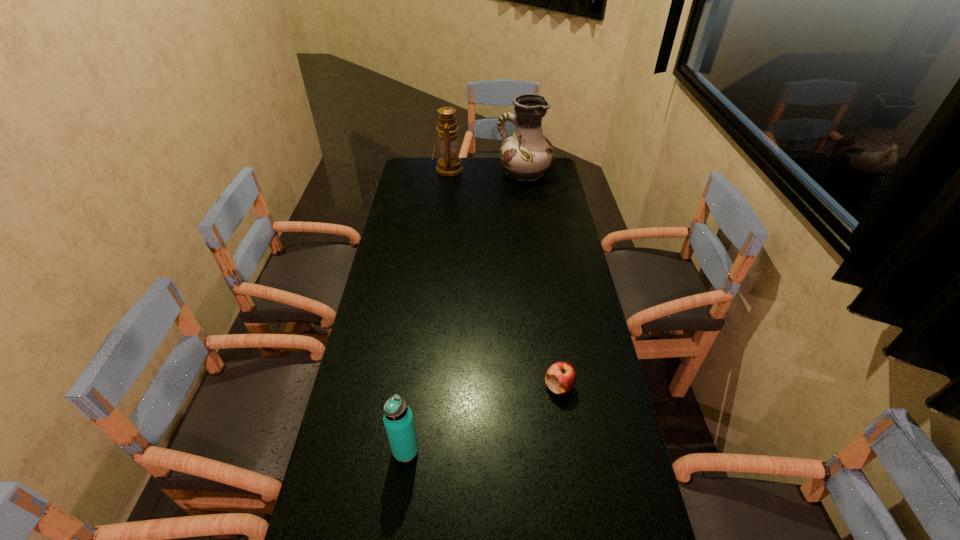
Where is `vase`? This screenshot has height=540, width=960. vase is located at coordinates (527, 154).

Find the location of a particular element. the second tallest object is located at coordinates (450, 164).

At what (x,y) coordinates should I click in order to perform the action: click on water bottle. Please return your answer as a coordinate pair (x, y). Looking at the image, I should click on (398, 419).

This screenshot has height=540, width=960. Find the location of `the nearest object`. the nearest object is located at coordinates (398, 419).

In order to click on apple in this screenshot , I will do `click(560, 377)`.

At what (x,y) coordinates should I click in order to perform the action: click on the shortest object. Please return your answer as a coordinate pair (x, y). The image size is (960, 540). Looking at the image, I should click on pyautogui.click(x=560, y=377).

What are the coordinates of `free region located 0.220m on the left of the vase` in the screenshot? It's located at pyautogui.click(x=450, y=173).

Locate an element on the screen. This screenshot has width=960, height=540. vacant region located on the front of the oil lamp is located at coordinates (443, 222).

The width and height of the screenshot is (960, 540). Identify the location of blank space located on the front of the nearest object. [397, 511].

At what (x,y) coordinates should I click in order to perform the action: click on vacant space located on the front of the second nearest object. Please return your answer as a coordinate pair (x, y). Looking at the image, I should click on (566, 434).